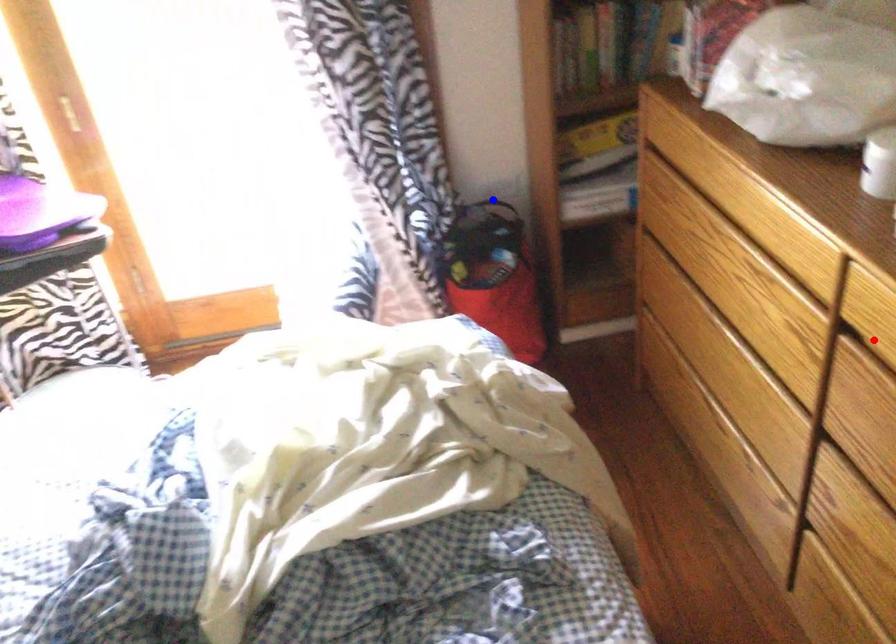
Question: Two points are marked on the image. Which point is closer to the camera?

Choices:
 (A) Blue point is closer.
 (B) Red point is closer.

Answer: (B)